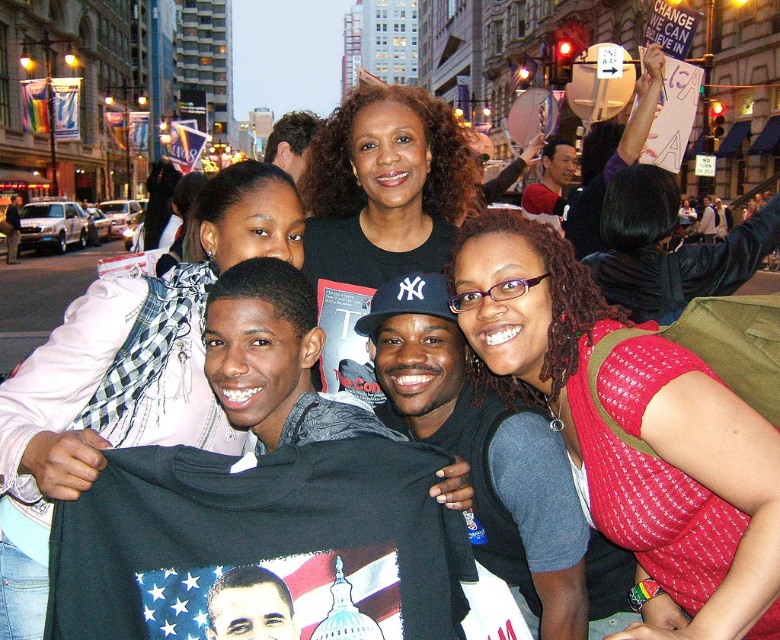
You are a photographer standing in the middle of the street, and you want to take a photo of both the red quilted vest at center and the white scarf at upper left. Which object should you focus on first to ensure both are in sharp focus?

You should focus on the red quilted vest at center first because it is closer to you than the white scarf at upper left, so focusing on the closer object will help both be in focus.